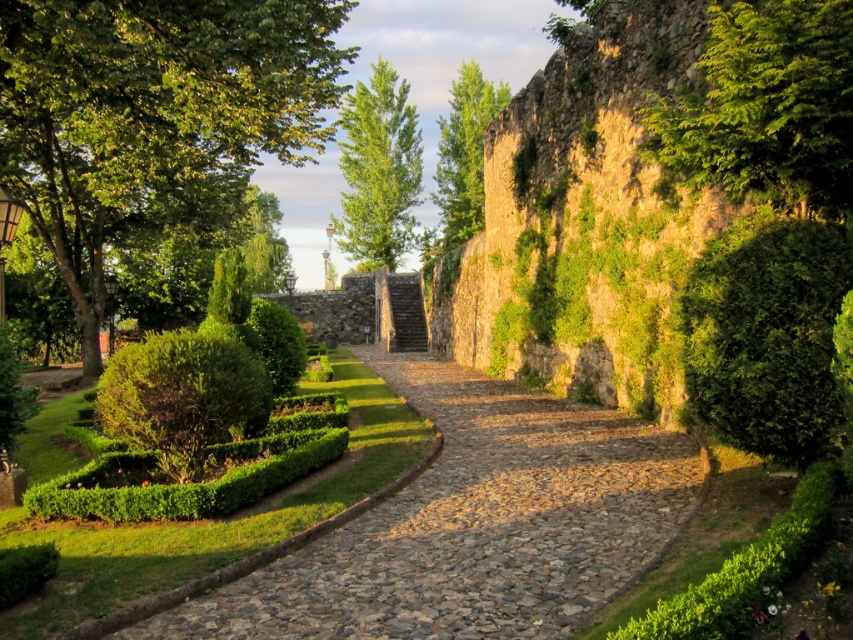
You are standing at the starting point of the cobblestone pathway in the image. You see two points marked on the path. The first point is at coordinates point (807,116), and the second point is at coordinates point (161,380). Which point is closer to you as you stand at the starting point?

Point (807,116) is closer to the camera than point (161,380), so the first point is closer to you as you stand at the starting point.